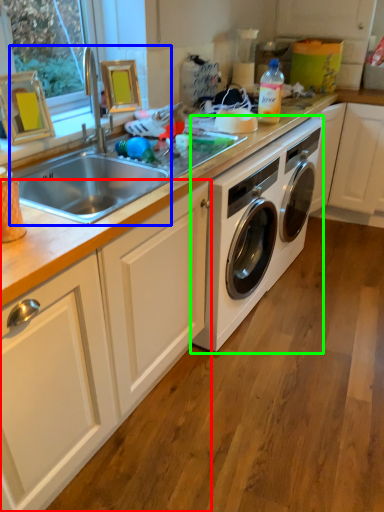
Question: Based on their relative distances, which object is nearer to cabinetry (highlighted by a red box)? Choose from sink (highlighted by a blue box) and washing machine (highlighted by a green box).

Choices:
 (A) sink
 (B) washing machine

Answer: (A)